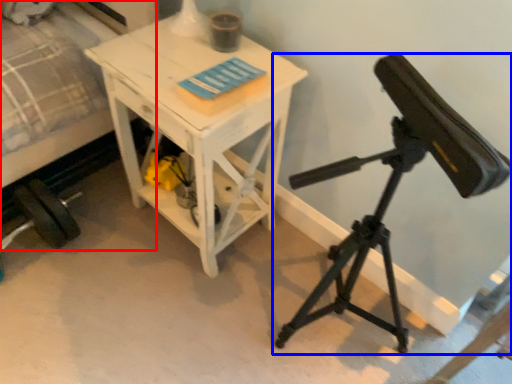
Question: Which object appears farthest to the camera in this image, bed (highlighted by a red box) or tripod (highlighted by a blue box)?

Choices:
 (A) bed
 (B) tripod

Answer: (A)